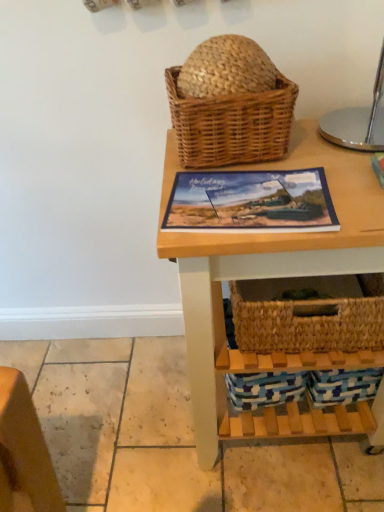
Where is `free spot below matte plastic picture frame at center (from a real-world perspective)`? free spot below matte plastic picture frame at center (from a real-world perspective) is located at coordinates (246, 200).